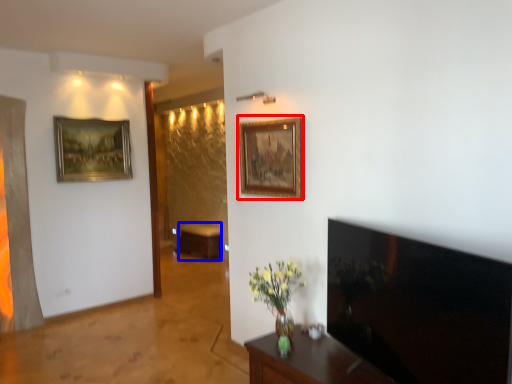
Question: Which object appears farthest to the camera in this image, picture frame (highlighted by a red box) or table (highlighted by a blue box)?

Choices:
 (A) picture frame
 (B) table

Answer: (B)